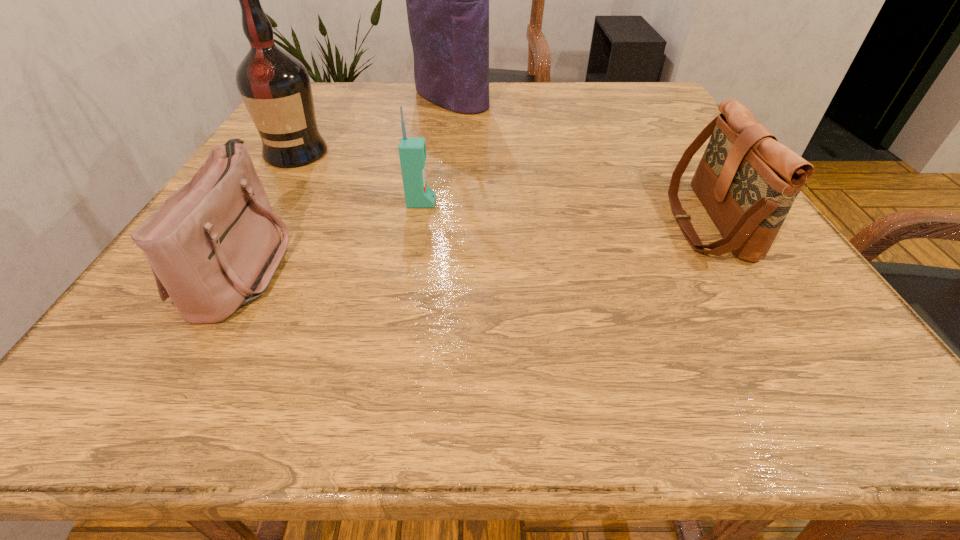
The image size is (960, 540). In order to click on the tallest object in this screenshot , I will do `click(447, 0)`.

Find the location of a particular element. This screenshot has width=960, height=540. the farthest object is located at coordinates (447, 0).

Where is `the fourth shortest object`? The width and height of the screenshot is (960, 540). the fourth shortest object is located at coordinates (275, 86).

Where is `liquor`? liquor is located at coordinates (275, 86).

Locate an element on the screen. cellular telephone is located at coordinates (412, 151).

You are a GUI agent. You are given a task and a screenshot of the screen. Output one action in this format:
    pyautogui.click(x=<x>, y=<y>)
    Task: Click on the right shoulder bag
    Image resolution: width=960 pixels, height=540 pixels.
    Given the screenshot: What is the action you would take?
    pyautogui.click(x=747, y=181)

What are the coordinates of `the left shoulder bag` in the screenshot? It's located at (214, 245).

Identify the location of free spot located on the front of the farthest object. (442, 177).

Locate an element on the screen. The height and width of the screenshot is (540, 960). vacant space located 0.150m on the surface of the fourth nearest object is located at coordinates (260, 213).

Find the location of a particular element. The width and height of the screenshot is (960, 540). vacant region located 0.330m on the keypad of the cellular telephone is located at coordinates (613, 203).